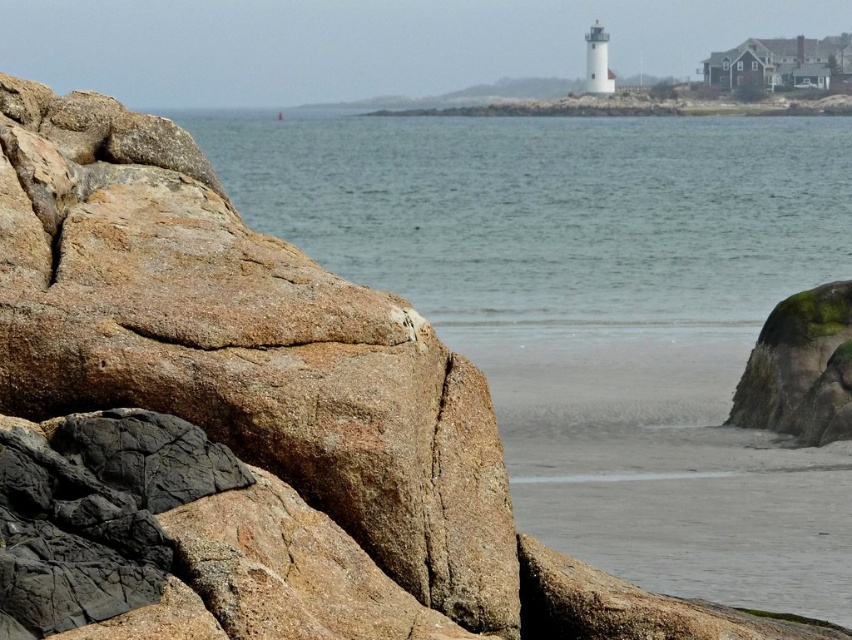
Is brown rough rock at left to the right of clear water at center from the viewer's perspective?

In fact, brown rough rock at left is to the left of clear water at center.

Does brown rough rock at left have a smaller size compared to clear water at center?

Yes, brown rough rock at left is smaller than clear water at center.

Image resolution: width=852 pixels, height=640 pixels. In order to click on brown rough rock at left in this screenshot , I will do `click(242, 346)`.

I want to click on brown rough rock at left, so click(242, 346).

Is point (395, 262) behind point (812, 433)?

Yes.

Which of these two, clear water at center or green mossy rock at lower right, stands shorter?

green mossy rock at lower right

Which is in front, point (378, 186) or point (767, 403)?

Point (767, 403) is in front.

I want to click on clear water at center, so click(550, 209).

What do you see at coordinates (242, 346) in the screenshot? I see `brown rough rock at left` at bounding box center [242, 346].

Who is more distant from viewer, (130, 170) or (827, 356)?

Point (827, 356)

Between point (16, 141) and point (809, 321), which one is positioned in front?

Point (16, 141) is in front.

You are a GUI agent. You are given a task and a screenshot of the screen. Output one action in this format:
    pyautogui.click(x=<x>, y=<y>)
    Task: Click on the brown rough rock at left
    Image resolution: width=852 pixels, height=640 pixels.
    Given the screenshot: What is the action you would take?
    pyautogui.click(x=242, y=346)